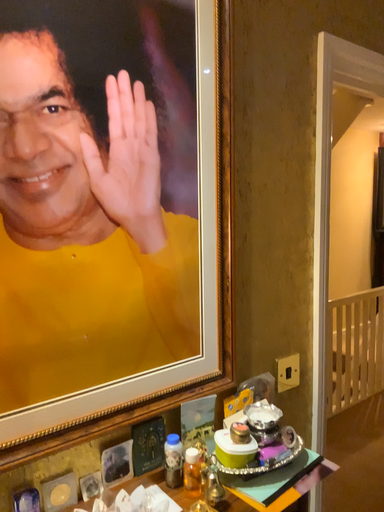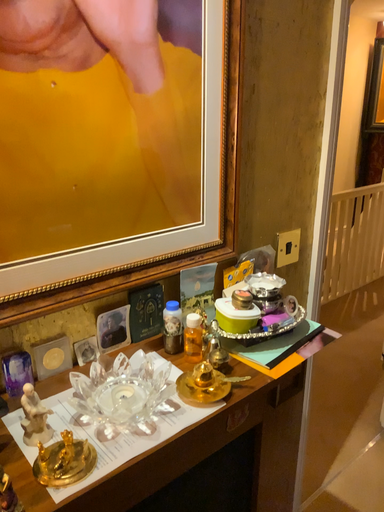
Question: How did the camera likely rotate when shooting the video?

Choices:
 (A) rotated upward
 (B) rotated downward

Answer: (B)